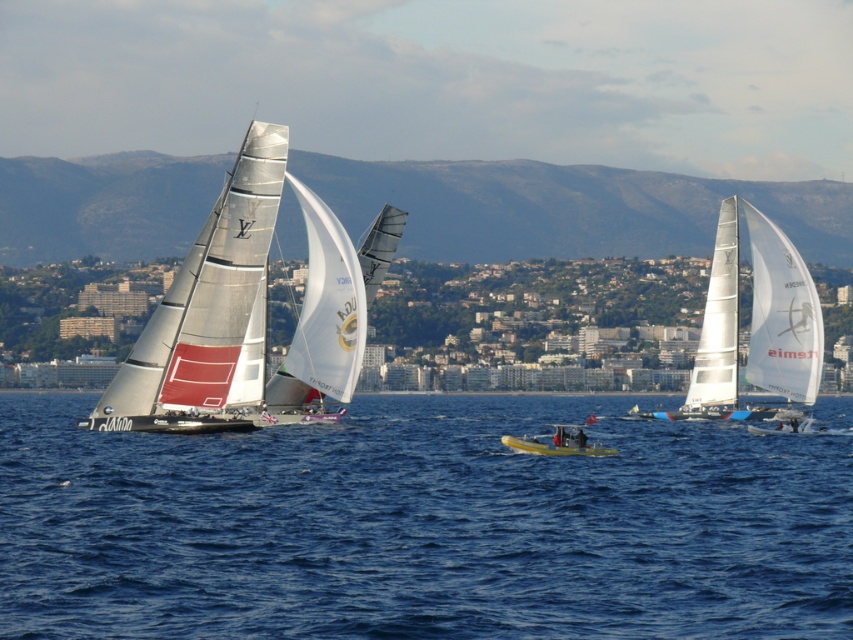
Question: Which point is farther to the camera?

Choices:
 (A) (572, 426)
 (B) (146, 365)
 (C) (796, 374)

Answer: (A)

Question: Considering the real-world distances, which object is farthest from the silver metallic sailboat at left?

Choices:
 (A) white matte sailboat at right
 (B) blue water at center

Answer: (A)

Question: Does blue water at center appear over silver metallic sailboat at left?

Choices:
 (A) no
 (B) yes

Answer: (A)

Question: Is silver metallic sailboat at left below white matte sailboat at right?

Choices:
 (A) yes
 (B) no

Answer: (B)

Question: In this image, where is silver metallic sailboat at left located relative to white matte sailboat at right?

Choices:
 (A) left
 (B) right

Answer: (A)

Question: Which point is farther to the camera?

Choices:
 (A) yellow plastic kayak at center
 (B) silver metallic sailboat at left
 (C) white matte sailboat at right

Answer: (C)